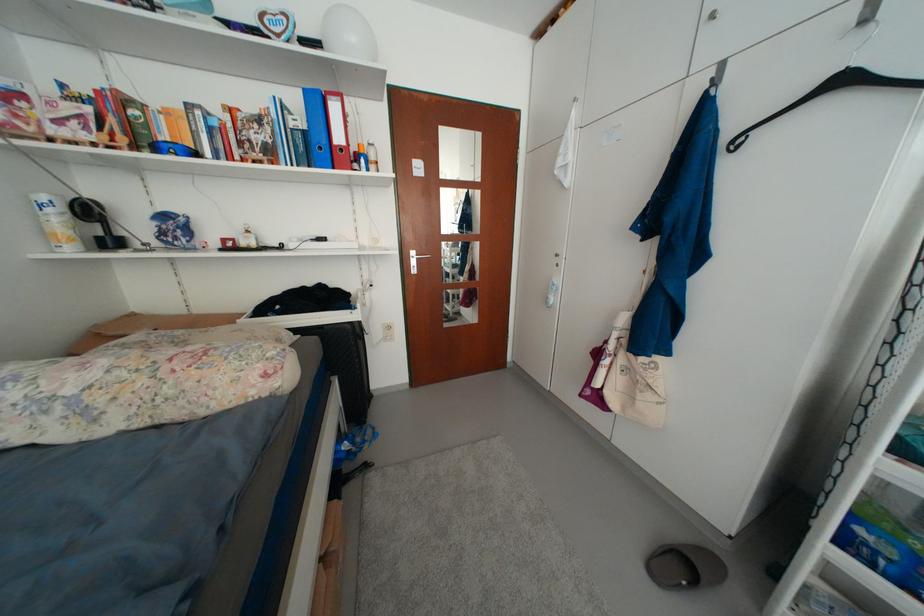
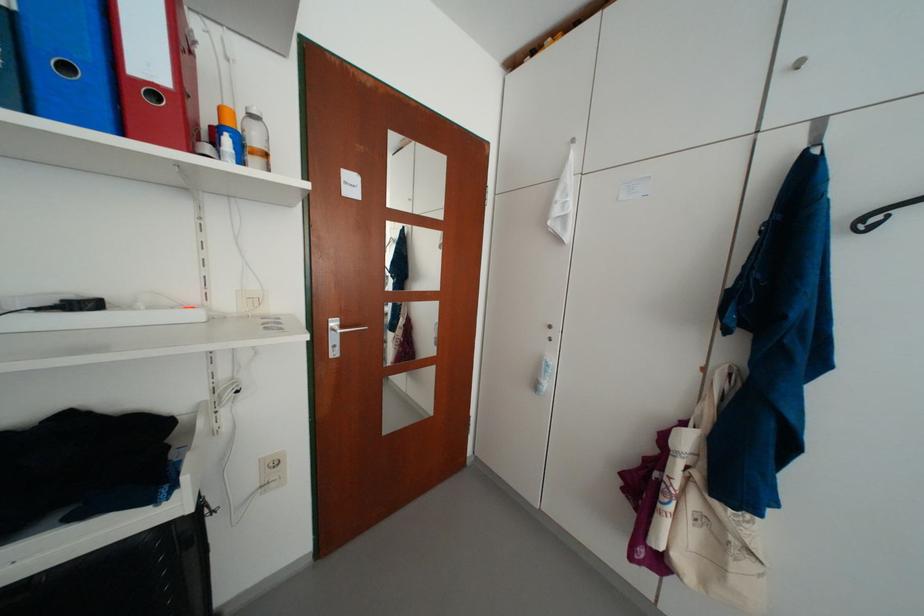
In the second image, find the point that corresponds to the point at 371,163 in the first image.

(236, 143)